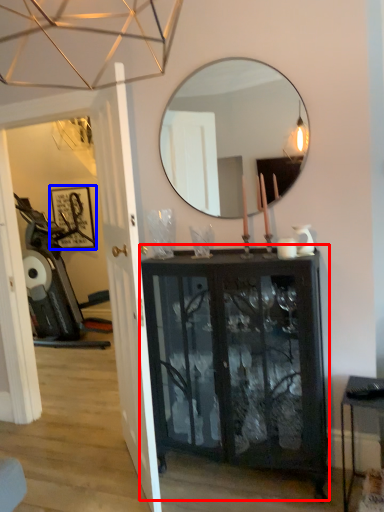
Question: Which object is closer to the camera taking this photo, cabinetry (highlighted by a red box) or picture frame (highlighted by a blue box)?

Choices:
 (A) cabinetry
 (B) picture frame

Answer: (A)